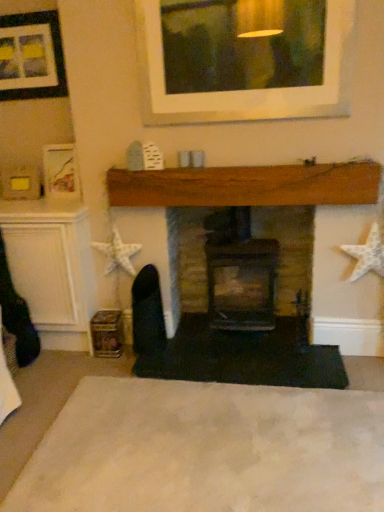
What do you see at coordinates (229, 347) in the screenshot?
I see `wooden fireplace at center, which is the 1th fireplace in left-to-right order` at bounding box center [229, 347].

This screenshot has height=512, width=384. What do you see at coordinates (206, 450) in the screenshot?
I see `white soft carpet at lower center` at bounding box center [206, 450].

In order to click on wooden fireplace at center, which is the 1th fireplace in left-to-right order in this screenshot , I will do `click(229, 347)`.

What's the angular difference between brick fireplace at center, the first fireplace from the right, and matte black picture frame at upper left's facing directions?

0.477 degrees separate the facing orientations of brick fireplace at center, the first fireplace from the right, and matte black picture frame at upper left.

Is brick fireplace at center, the first fireplace from the right, positioned beyond the bounds of matte black picture frame at upper left?

Yes, brick fireplace at center, the first fireplace from the right, is not within matte black picture frame at upper left.

Is brick fireplace at center, placed as the second fireplace when sorted from left to right, positioned behind matte black picture frame at upper left?

No, brick fireplace at center, placed as the second fireplace when sorted from left to right, is closer to the camera.

Is brick fireplace at center, the first fireplace from the right, bigger or smaller than matte black picture frame at upper left?

In the image, brick fireplace at center, the first fireplace from the right, appears to be larger than matte black picture frame at upper left.

Is white soft carpet at lower center closer to the viewer compared to wooden fireplace at center, which is the 1th fireplace in left-to-right order?

Yes, it is.

Is there a large distance between white soft carpet at lower center and wooden fireplace at center, which is the 1th fireplace in left-to-right order?

No, white soft carpet at lower center is not far from wooden fireplace at center, which is the 1th fireplace in left-to-right order.

Where is `plain on the left of wooden fireplace at center, which is the 1th fireplace in left-to-right order`? plain on the left of wooden fireplace at center, which is the 1th fireplace in left-to-right order is located at coordinates (206, 450).

Considering the relative sizes of white soft carpet at lower center and matte black picture frame at upper left in the image provided, is white soft carpet at lower center taller than matte black picture frame at upper left?

Incorrect, the height of white soft carpet at lower center is not larger of that of matte black picture frame at upper left.

From a real-world perspective, is white soft carpet at lower center positioned under matte black picture frame at upper left based on gravity?

Indeed, from a real-world perspective, white soft carpet at lower center is positioned beneath matte black picture frame at upper left.

Can you confirm if white soft carpet at lower center is positioned to the right of matte black picture frame at upper left?

Correct, you'll find white soft carpet at lower center to the right of matte black picture frame at upper left.

Is the depth of white soft carpet at lower center less than that of matte black picture frame at upper left?

Yes, the depth of white soft carpet at lower center is less than that of matte black picture frame at upper left.

In the image, is white soft carpet at lower center positioned in front of or behind brick fireplace at center, the first fireplace from the right?

In the image, white soft carpet at lower center appears in front of brick fireplace at center, the first fireplace from the right.

From the image's perspective, is white soft carpet at lower center located above brick fireplace at center, placed as the second fireplace when sorted from left to right?

No.

Is white soft carpet at lower center oriented away from brick fireplace at center, the first fireplace from the right?

white soft carpet at lower center is not turned away from brick fireplace at center, the first fireplace from the right.

Based on their positions, is wooden fireplace at center, which is the 1th fireplace in left-to-right order, located to the left or right of white soft carpet at lower center?

From the image, it's evident that wooden fireplace at center, which is the 1th fireplace in left-to-right order, is to the right of white soft carpet at lower center.

From the image's perspective, would you say wooden fireplace at center, which is the 1th fireplace in left-to-right order, is shown under white soft carpet at lower center?

No.

The width and height of the screenshot is (384, 512). I want to click on plain below the wooden fireplace at center, arranged as the second fireplace when viewed from the right (from a real-world perspective), so pyautogui.click(x=206, y=450).

Which is more to the right, matte black picture frame at upper left or brick fireplace at center, the first fireplace from the right?

Positioned to the right is brick fireplace at center, the first fireplace from the right.

Considering the relative sizes of matte black picture frame at upper left and brick fireplace at center, the first fireplace from the right, in the image provided, is matte black picture frame at upper left taller than brick fireplace at center, the first fireplace from the right,?

No.

Looking at their sizes, would you say matte black picture frame at upper left is wider or thinner than brick fireplace at center, placed as the second fireplace when sorted from left to right?

Considering their sizes, matte black picture frame at upper left looks slimmer than brick fireplace at center, placed as the second fireplace when sorted from left to right.

Can we say matte black picture frame at upper left lies outside brick fireplace at center, placed as the second fireplace when sorted from left to right?

That's correct, matte black picture frame at upper left is outside of brick fireplace at center, placed as the second fireplace when sorted from left to right.

Between matte black picture frame at upper left and white soft carpet at lower center, which one has smaller size?

matte black picture frame at upper left is smaller.

Where is `picture frame on the left side of white soft carpet at lower center`? picture frame on the left side of white soft carpet at lower center is located at coordinates (31, 57).

Which is farther, (28, 23) or (354, 476)?

Positioned behind is point (28, 23).

From the image's perspective, is matte black picture frame at upper left below white soft carpet at lower center?

Actually, matte black picture frame at upper left appears above white soft carpet at lower center in the image.

There is a matte black picture frame at upper left. Identify the location of the 2nd fireplace below it (from the image's perspective). The width and height of the screenshot is (384, 512). (288, 249).

Where is `fireplace that is the 1st object located behind the white soft carpet at lower center`? Image resolution: width=384 pixels, height=512 pixels. fireplace that is the 1st object located behind the white soft carpet at lower center is located at coordinates (229, 347).

Consider the image. From the image, which object appears to be farther from wooden fireplace at center, arranged as the second fireplace when viewed from the right, brick fireplace at center, the first fireplace from the right, or white soft carpet at lower center?

Based on the image, white soft carpet at lower center appears to be further to wooden fireplace at center, arranged as the second fireplace when viewed from the right.

When comparing their distances from matte black picture frame at upper left, does brick fireplace at center, placed as the second fireplace when sorted from left to right, or wooden fireplace at center, arranged as the second fireplace when viewed from the right, seem further?

The object further to matte black picture frame at upper left is wooden fireplace at center, arranged as the second fireplace when viewed from the right.

Considering their positions, is wooden fireplace at center, which is the 1th fireplace in left-to-right order, positioned further to white soft carpet at lower center than brick fireplace at center, placed as the second fireplace when sorted from left to right?

brick fireplace at center, placed as the second fireplace when sorted from left to right, is further to white soft carpet at lower center.

Estimate the real-world distances between objects in this image. Which object is further from white soft carpet at lower center, wooden fireplace at center, which is the 1th fireplace in left-to-right order, or matte black picture frame at upper left?

Based on the image, matte black picture frame at upper left appears to be further to white soft carpet at lower center.

Considering their positions, is wooden fireplace at center, arranged as the second fireplace when viewed from the right, positioned further to brick fireplace at center, placed as the second fireplace when sorted from left to right, than white soft carpet at lower center?

white soft carpet at lower center is further to brick fireplace at center, placed as the second fireplace when sorted from left to right.

Considering their positions, is brick fireplace at center, the first fireplace from the right, positioned further to wooden fireplace at center, which is the 1th fireplace in left-to-right order, than matte black picture frame at upper left?

matte black picture frame at upper left lies further to wooden fireplace at center, which is the 1th fireplace in left-to-right order, than the other object.

Based on their spatial positions, is white soft carpet at lower center or wooden fireplace at center, which is the 1th fireplace in left-to-right order, closer to brick fireplace at center, placed as the second fireplace when sorted from left to right?

wooden fireplace at center, which is the 1th fireplace in left-to-right order, is closer to brick fireplace at center, placed as the second fireplace when sorted from left to right.

When comparing their distances from wooden fireplace at center, arranged as the second fireplace when viewed from the right, does white soft carpet at lower center or matte black picture frame at upper left seem further?

Among the two, matte black picture frame at upper left is located further to wooden fireplace at center, arranged as the second fireplace when viewed from the right.

Locate an element on the screen. This screenshot has width=384, height=512. fireplace between matte black picture frame at upper left and brick fireplace at center, placed as the second fireplace when sorted from left to right is located at coordinates (229, 347).

This screenshot has height=512, width=384. I want to click on fireplace located between white soft carpet at lower center and brick fireplace at center, the first fireplace from the right, in the depth direction, so click(x=229, y=347).